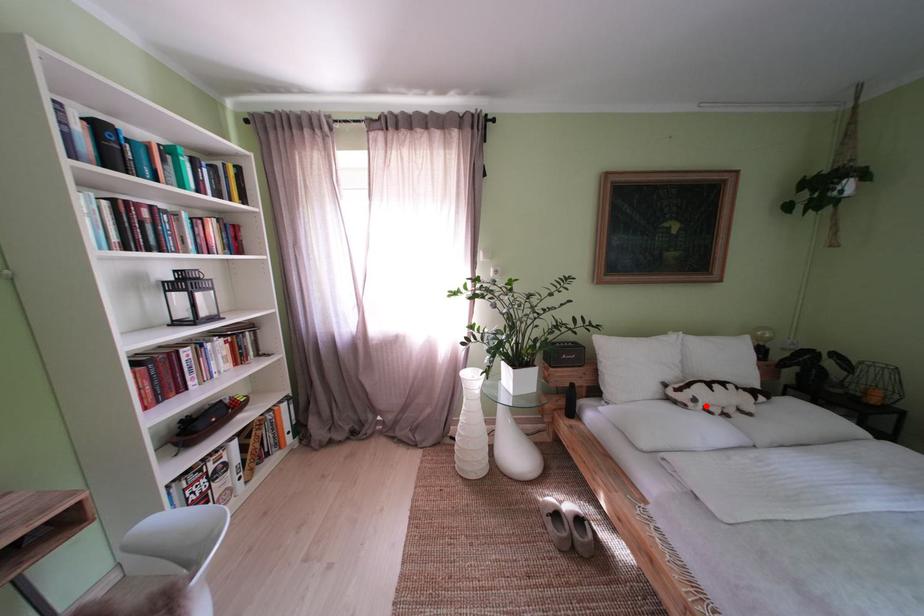
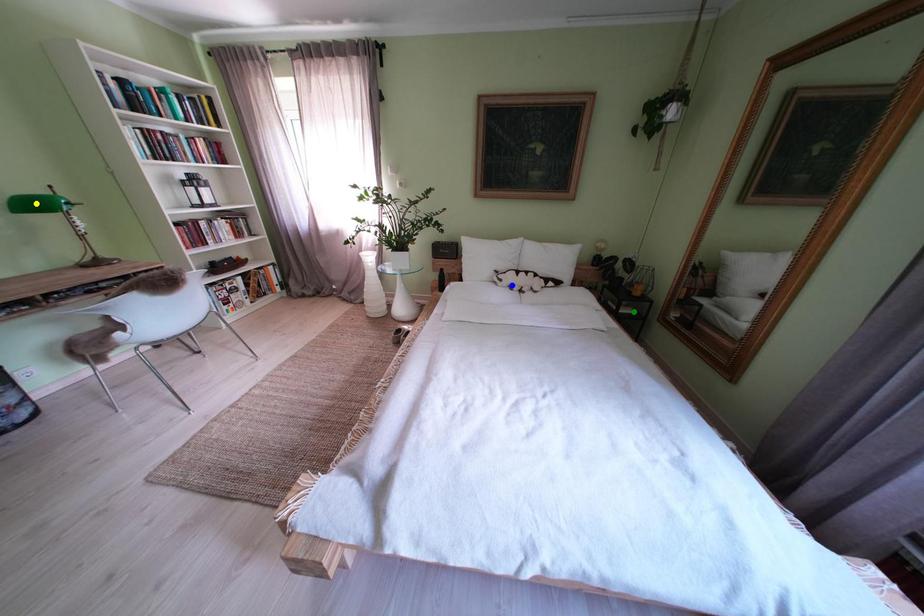
Question: I am providing you with two images of the same scene from different viewpoints. A red point is marked on the first image. You are given multiple points on the second image. Which point in image 2 represents the same 3d spot as the red point in image 1?

Choices:
 (A) yellow point
 (B) blue point
 (C) green point

Answer: (B)